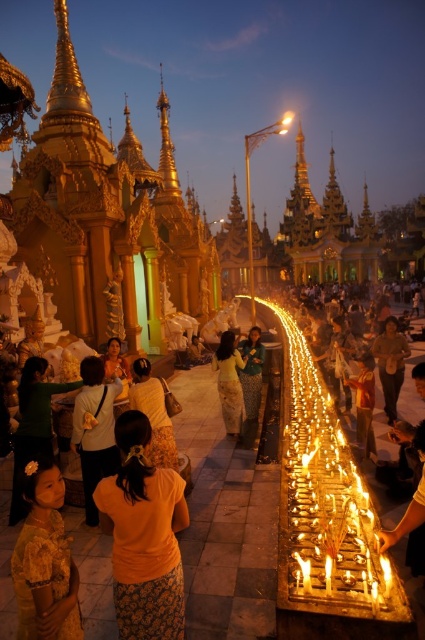
Can you confirm if yellow fabric at center is positioned to the right of orange fabric dress at center?

No, yellow fabric at center is not to the right of orange fabric dress at center.

Can you confirm if yellow fabric at center is taller than orange fabric dress at center?

No, yellow fabric at center is not taller than orange fabric dress at center.

What do you see at coordinates (153, 413) in the screenshot? This screenshot has height=640, width=425. I see `yellow fabric at center` at bounding box center [153, 413].

This screenshot has width=425, height=640. Find the location of `yellow fabric at center`. yellow fabric at center is located at coordinates (153, 413).

Who is positioned more to the right, matte green dress at lower left or orange fabric dress at center?

orange fabric dress at center

What do you see at coordinates (33, 426) in the screenshot?
I see `matte green dress at lower left` at bounding box center [33, 426].

Is point (19, 428) behind point (229, 368)?

No, it is not.

The width and height of the screenshot is (425, 640). Identify the location of matte green dress at lower left. (33, 426).

Between white fabric bag at center and matte green dress at center, which one has less height?

Standing shorter between the two is matte green dress at center.

From the picture: Can you confirm if white fabric bag at center is positioned below matte green dress at center?

Yes, white fabric bag at center is below matte green dress at center.

Who is more forward, (88, 364) or (261, 380)?

Point (88, 364)

You are a GUI agent. You are given a task and a screenshot of the screen. Output one action in this format:
    pyautogui.click(x=<x>, y=<y>)
    Task: Click on the white fabric bag at center
    The image size is (425, 640).
    Given the screenshot: What is the action you would take?
    pyautogui.click(x=95, y=429)